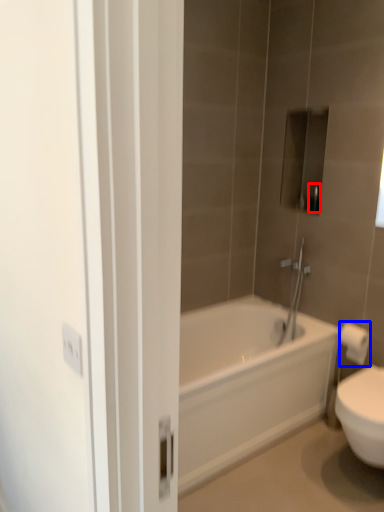
Question: Which object is further to the camera taking this photo, toiletry (highlighted by a red box) or toilet paper (highlighted by a blue box)?

Choices:
 (A) toiletry
 (B) toilet paper

Answer: (A)